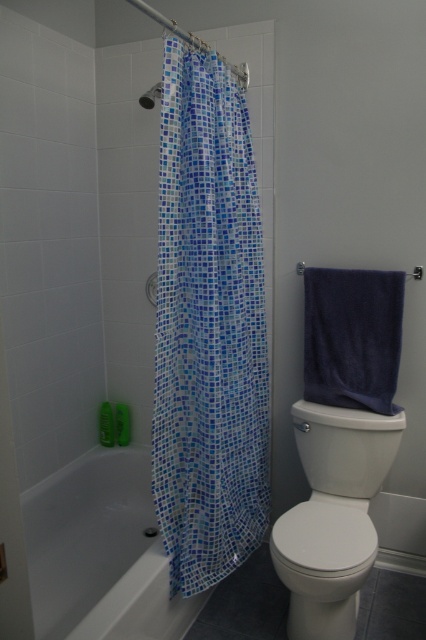
Question: Does blue mosaic fabric shower curtain at left appear on the left side of white glossy toilet at lower right?

Choices:
 (A) no
 (B) yes

Answer: (B)

Question: Is white glossy bathtub at lower left to the left of matte plastic shower head at upper left from the viewer's perspective?

Choices:
 (A) yes
 (B) no

Answer: (A)

Question: Estimate the real-world distances between objects in this image. Which object is farther from the white glossy toilet at lower right?

Choices:
 (A) blue mosaic fabric shower curtain at left
 (B) white glossy bathtub at lower left

Answer: (B)

Question: Estimate the real-world distances between objects in this image. Which object is closer to the blue mosaic fabric shower curtain at left?

Choices:
 (A) white glossy bathtub at lower left
 (B) white glossy toilet at lower right
 (C) matte plastic shower head at upper left
 (D) transparent plastic screen door at left

Answer: (B)

Question: Does white glossy toilet at lower right have a smaller size compared to transparent plastic screen door at left?

Choices:
 (A) no
 (B) yes

Answer: (A)

Question: Which of the following is the farthest from the observer?

Choices:
 (A) (353, 547)
 (B) (249, 381)

Answer: (B)